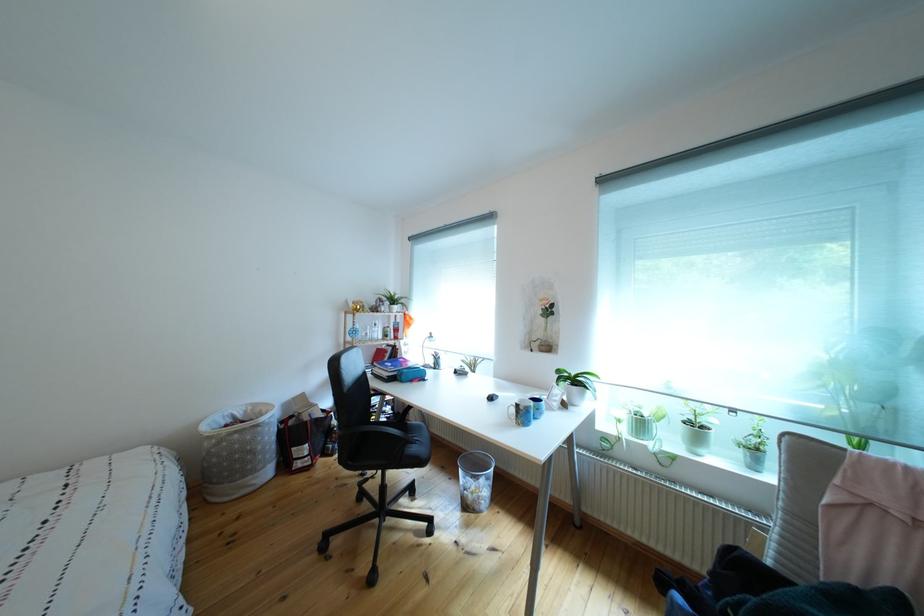
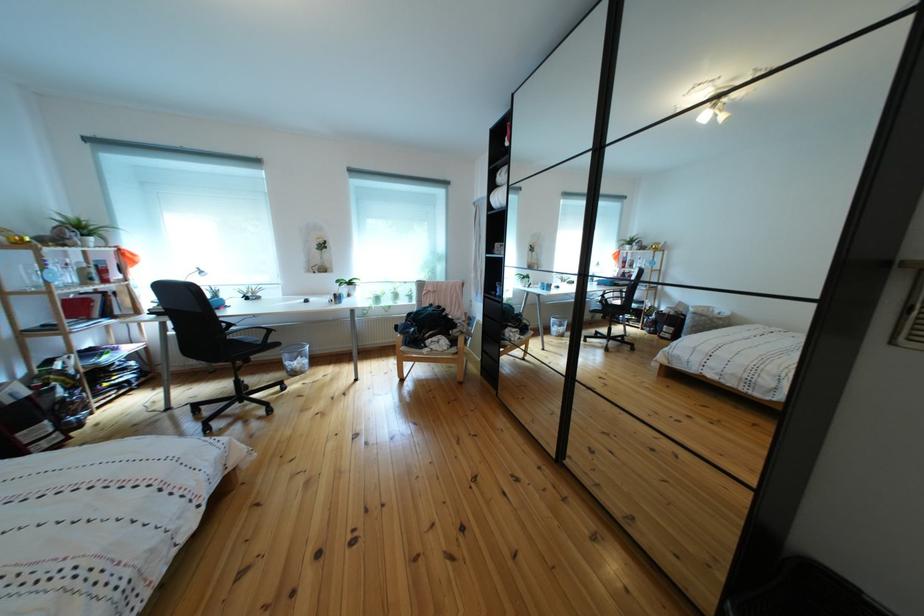
Find the pixel in the second image that matches (x=573, y=381) in the first image.

(351, 288)